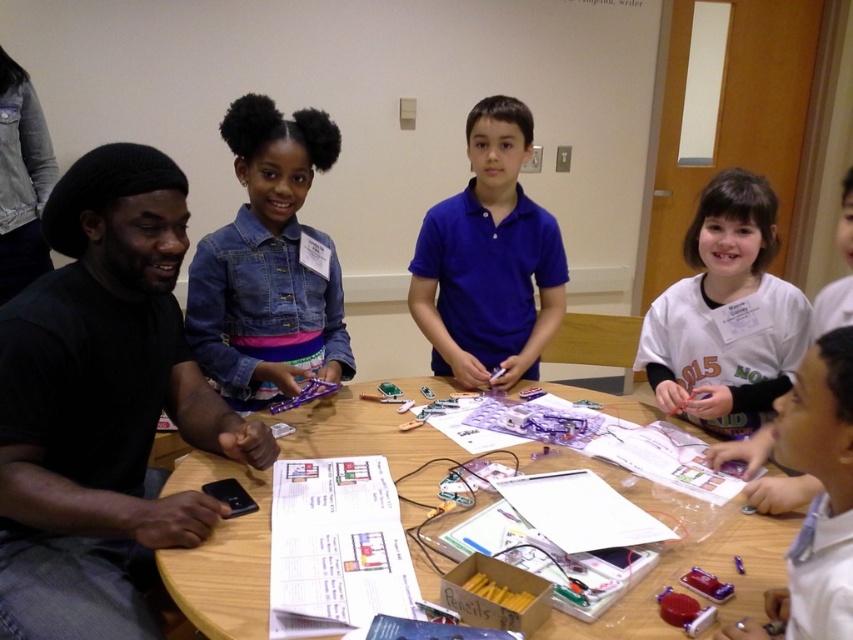
You are a student standing in front of the wooden table at center. You want to place a 36 inch long ruler on the table. Can you place the ruler on the table without it hanging off the edge?

The wooden table at center is 38.22 inches away from the viewer. Since the ruler is 36 inches long, it can be placed on the table as the table is longer than the ruler.

You are a student who just entered the classroom and need to retrieve your denim jacket at upper left from the table. The table is 6 feet away from you. Can you reach it without moving closer?

The denim jacket at upper left is 5.26 feet from the camera, which is closer than the 6 feet distance to the table. Therefore, you can reach it without moving closer.

You are a teacher observing the classroom scene. You need to hand out a pencil to the student wearing the denim jacket at upper left and the student wearing the white glossy shirt at lower right. Which student will you approach first to ensure you can reach them without moving past the other student?

You should approach the denim jacket at upper left first because it is closer to you than the white glossy shirt at lower right, so you can reach them without needing to move past the other student.